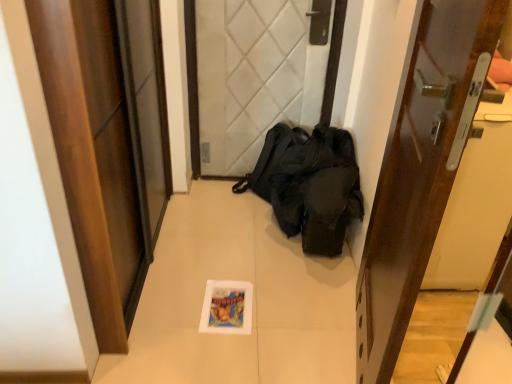
Question: Is wooden door at left, which appears as the 3th door when viewed from the right, aimed at wooden glossy door at right, arranged as the third door when viewed from the left?

Choices:
 (A) no
 (B) yes

Answer: (B)

Question: Is wooden glossy door at right, arranged as the third door when viewed from the left, a part of wooden door at left, which appears as the 3th door when viewed from the right?

Choices:
 (A) no
 (B) yes

Answer: (A)

Question: Considering the relative sizes of wooden door at left, which appears as the 3th door when viewed from the right, and wooden glossy door at right, the 1th door positioned from the right, in the image provided, is wooden door at left, which appears as the 3th door when viewed from the right, smaller than wooden glossy door at right, the 1th door positioned from the right,?

Choices:
 (A) yes
 (B) no

Answer: (B)

Question: Is wooden door at left, which appears as the 3th door when viewed from the right, at the right side of wooden glossy door at right, the 1th door positioned from the right?

Choices:
 (A) yes
 (B) no

Answer: (B)

Question: Is wooden door at left, placed as the first door when sorted from left to right, thinner than wooden glossy door at right, the 1th door positioned from the right?

Choices:
 (A) yes
 (B) no

Answer: (B)

Question: Is point (243, 86) closer or farther from the camera than point (71, 1)?

Choices:
 (A) closer
 (B) farther

Answer: (B)

Question: Considering the positions of white quilted fabric at center, which is the second door in left-to-right order, and wooden door at left, placed as the first door when sorted from left to right, in the image, is white quilted fabric at center, which is the second door in left-to-right order, taller or shorter than wooden door at left, placed as the first door when sorted from left to right,?

Choices:
 (A) tall
 (B) short

Answer: (B)

Question: From a real-world perspective, is white quilted fabric at center, the second door positioned from the right, physically located above or below wooden door at left, which appears as the 3th door when viewed from the right?

Choices:
 (A) below
 (B) above

Answer: (A)

Question: Visually, is white quilted fabric at center, the second door positioned from the right, positioned to the left or to the right of wooden door at left, which appears as the 3th door when viewed from the right?

Choices:
 (A) right
 (B) left

Answer: (A)

Question: Considering the positions of point (x=53, y=33) and point (x=245, y=104), is point (x=53, y=33) closer or farther from the camera than point (x=245, y=104)?

Choices:
 (A) closer
 (B) farther

Answer: (A)

Question: From a real-world perspective, is wooden door at left, placed as the first door when sorted from left to right, positioned above or below white quilted fabric at center, which is the second door in left-to-right order?

Choices:
 (A) below
 (B) above

Answer: (B)

Question: From the image's perspective, relative to white quilted fabric at center, which is the second door in left-to-right order, is wooden door at left, which appears as the 3th door when viewed from the right, above or below?

Choices:
 (A) below
 (B) above

Answer: (A)

Question: Would you say wooden door at left, which appears as the 3th door when viewed from the right, is inside or outside white quilted fabric at center, which is the second door in left-to-right order?

Choices:
 (A) inside
 (B) outside

Answer: (B)

Question: Looking at their shapes, would you say wooden glossy door at right, arranged as the third door when viewed from the left, is wider or thinner than white quilted fabric at center, which is the second door in left-to-right order?

Choices:
 (A) wide
 (B) thin

Answer: (B)

Question: Do you think wooden glossy door at right, the 1th door positioned from the right, is within white quilted fabric at center, which is the second door in left-to-right order, or outside of it?

Choices:
 (A) inside
 (B) outside

Answer: (B)